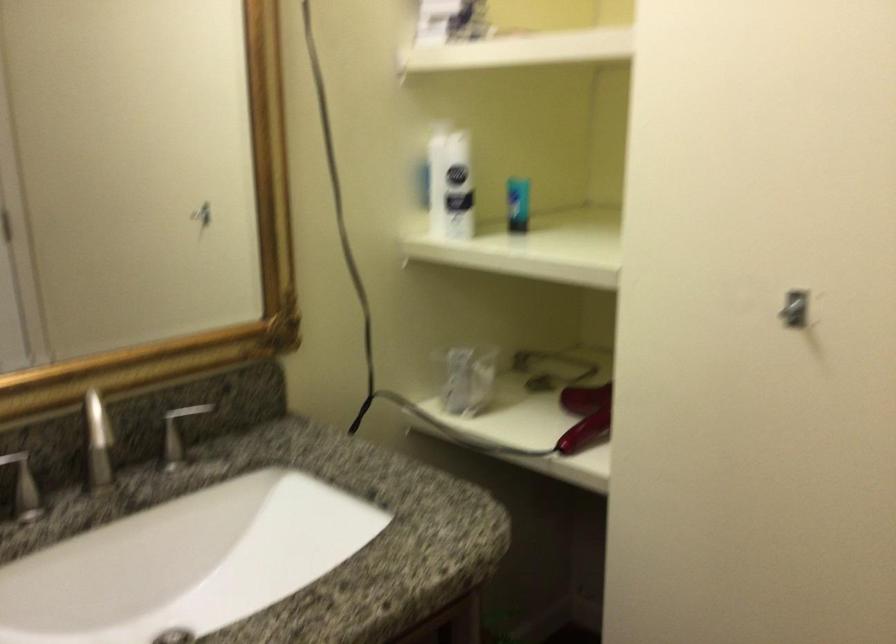
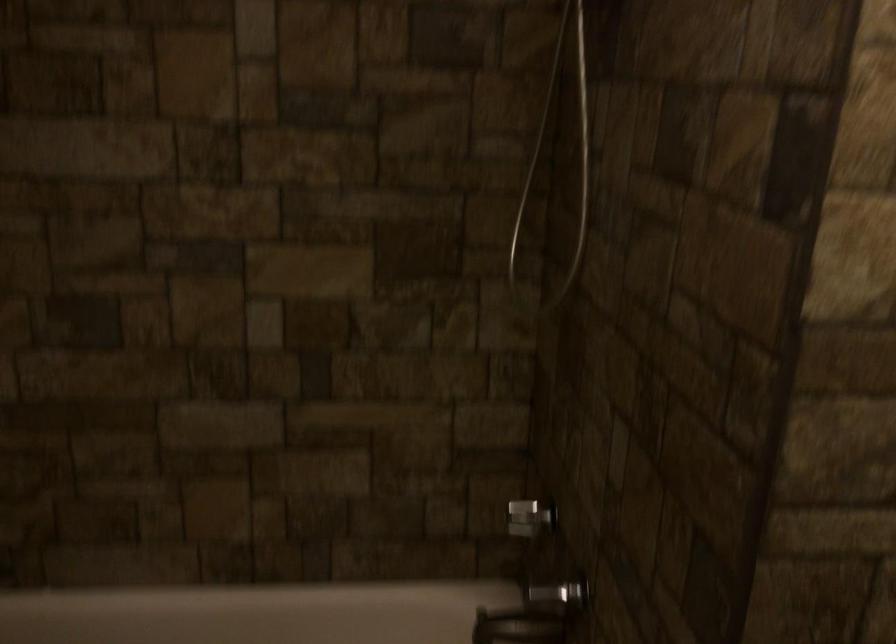
Question: The camera is either moving clockwise (left) or counter-clockwise (right) around the object. The first image is from the beginning of the video and the second image is from the end. Is the camera moving left or right when shooting the video?

Choices:
 (A) Left
 (B) Right

Answer: (B)